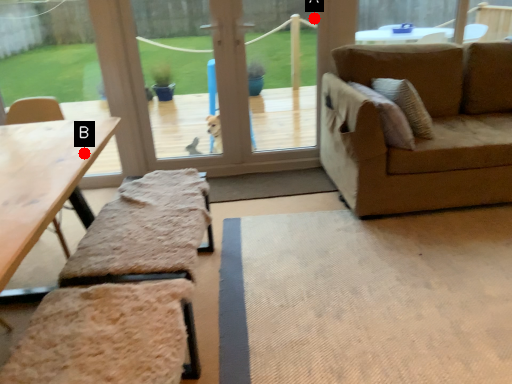
Question: Two points are circled on the image, labeled by A and B beside each circle. Which point is closer to the camera?

Choices:
 (A) A is closer
 (B) B is closer

Answer: (B)